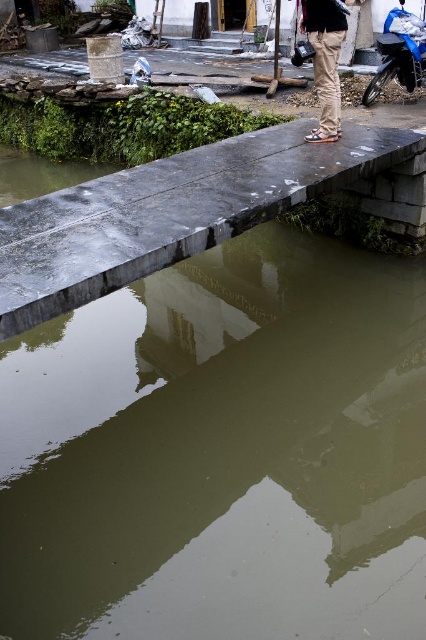
At what (x,y) coordinates should I click in order to perform the action: click on khaki cotton pants at center. Please return your answer as a coordinate pair (x, y). Image resolution: width=426 pixels, height=640 pixels. Looking at the image, I should click on (325, 61).

This screenshot has width=426, height=640. Describe the element at coordinates (325, 61) in the screenshot. I see `khaki cotton pants at center` at that location.

Find the location of `khaki cotton pants at center`. khaki cotton pants at center is located at coordinates (325, 61).

Does greenish murky water at center have a smaller size compared to blue matte motorcycle at upper right?

Indeed, greenish murky water at center has a smaller size compared to blue matte motorcycle at upper right.

Can you confirm if greenish murky water at center is wider than blue matte motorcycle at upper right?

Incorrect, greenish murky water at center's width does not surpass blue matte motorcycle at upper right's.

Is point (8, 376) closer to camera compared to point (394, 58)?

Yes.

I want to click on greenish murky water at center, so click(x=221, y=451).

Is greenish murky water at center to the left of khaki cotton pants at center from the viewer's perspective?

Indeed, greenish murky water at center is positioned on the left side of khaki cotton pants at center.

Does greenish murky water at center have a lesser width compared to khaki cotton pants at center?

No, greenish murky water at center is not thinner than khaki cotton pants at center.

Who is more distant from viewer, (160, 436) or (321, 4)?

The point (321, 4) is more distant.

Identify the location of greenish murky water at center. The width and height of the screenshot is (426, 640). (221, 451).